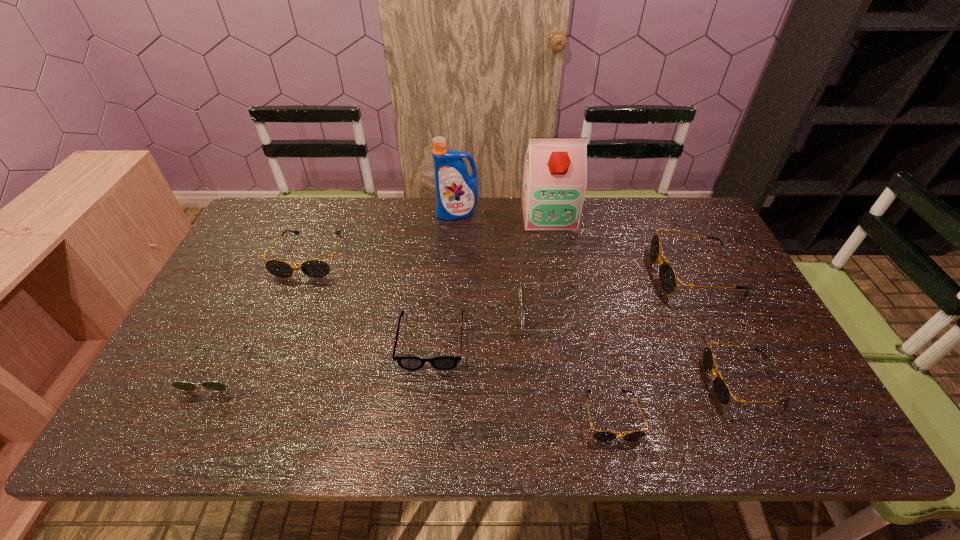
Find the location of a particular element. The height and width of the screenshot is (540, 960). object that is at the far left corner is located at coordinates (315, 268).

Image resolution: width=960 pixels, height=540 pixels. In order to click on object at the near right corner in this screenshot , I will do `click(721, 390)`.

Find the location of `vacant space at the far edge of the desktop`. vacant space at the far edge of the desktop is located at coordinates (346, 210).

In the image, there is a desktop. At what (x,y) coordinates should I click in order to perform the action: click on free space at the near edge. Please return your answer as a coordinate pair (x, y). This screenshot has width=960, height=540. Looking at the image, I should click on [x=694, y=428].

You are a GUI agent. You are given a task and a screenshot of the screen. Output one action in this format:
    pyautogui.click(x=<x>, y=<y>)
    Task: Click on the blank space at the left edge of the desktop
    The width and height of the screenshot is (960, 540).
    Given the screenshot: What is the action you would take?
    pyautogui.click(x=189, y=355)

In the image, there is a desktop. Where is `vacant space at the right edge`? The width and height of the screenshot is (960, 540). vacant space at the right edge is located at coordinates (741, 323).

The image size is (960, 540). In the image, there is a desktop. In order to click on vacant space at the near right corner in this screenshot , I will do 751,415.

Where is `free space between the third black sunglasses from right to left and the detergent`? The height and width of the screenshot is (540, 960). free space between the third black sunglasses from right to left and the detergent is located at coordinates [535, 315].

In order to click on free spot between the second tallest sunglasses and the detergent in this screenshot , I will do `click(384, 234)`.

The width and height of the screenshot is (960, 540). In order to click on empty space that is in between the soya milk and the smallest black sunglasses in this screenshot , I will do pos(580,315).